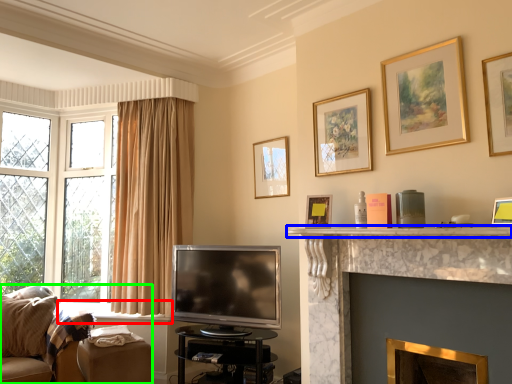
Question: Considering the real-world distances, which object is farthest from window sill (highlighted by a red box)? mantle (highlighted by a blue box) or studio couch (highlighted by a green box)?

Choices:
 (A) mantle
 (B) studio couch

Answer: (A)